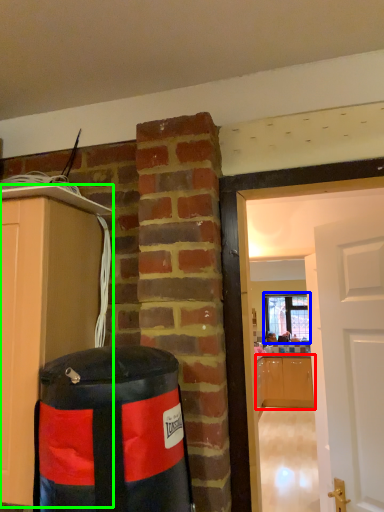
Question: Which is farther away from cabinetry (highlighted by a red box)? window (highlighted by a blue box) or cabinetry (highlighted by a green box)?

Choices:
 (A) window
 (B) cabinetry

Answer: (B)